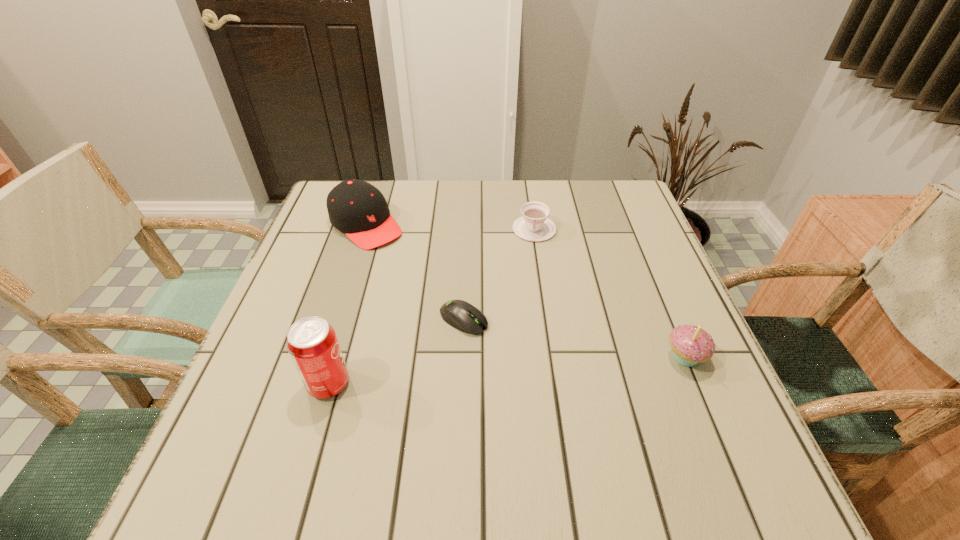
Locate an element on the screen. Image resolution: width=960 pixels, height=540 pixels. soda is located at coordinates (312, 343).

Locate an element on the screen. Image resolution: width=960 pixels, height=540 pixels. the rightmost object is located at coordinates (690, 344).

The height and width of the screenshot is (540, 960). I want to click on the fourth object from left to right, so click(x=534, y=226).

In order to click on the second shortest object in this screenshot , I will do `click(534, 226)`.

Locate an element on the screen. The height and width of the screenshot is (540, 960). cap is located at coordinates (355, 207).

Find the location of a particular element. the third object from left to right is located at coordinates (461, 315).

Where is `the shortest object`? The width and height of the screenshot is (960, 540). the shortest object is located at coordinates (461, 315).

I want to click on vacant space located 0.060m on the front of the soda, so click(314, 434).

At what (x,y) coordinates should I click in order to perform the action: click on free space located 0.370m on the back of the cupcake. Please return your answer as a coordinate pair (x, y). The width and height of the screenshot is (960, 540). Looking at the image, I should click on (633, 232).

Identify the location of free region located on the handle side of the second object from right to left. (531, 273).